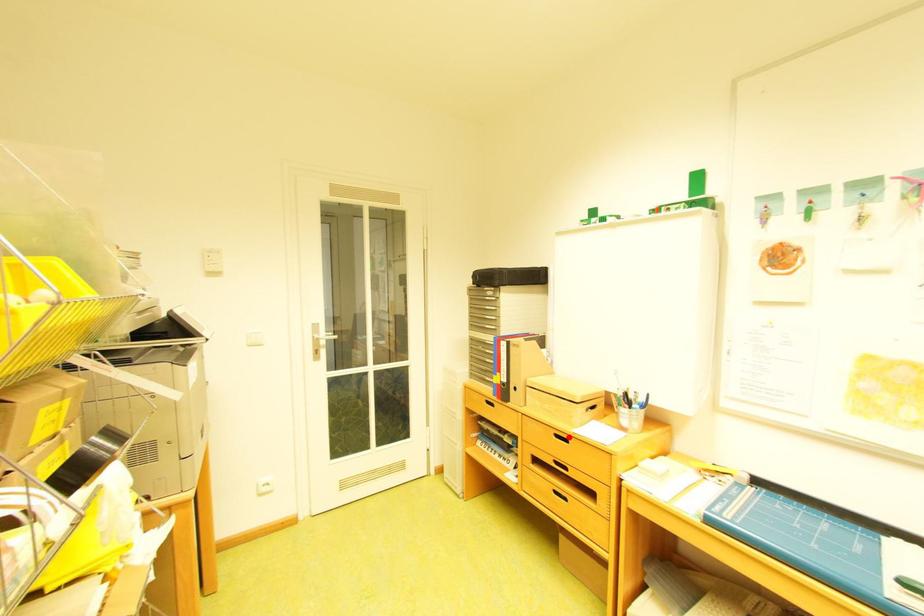
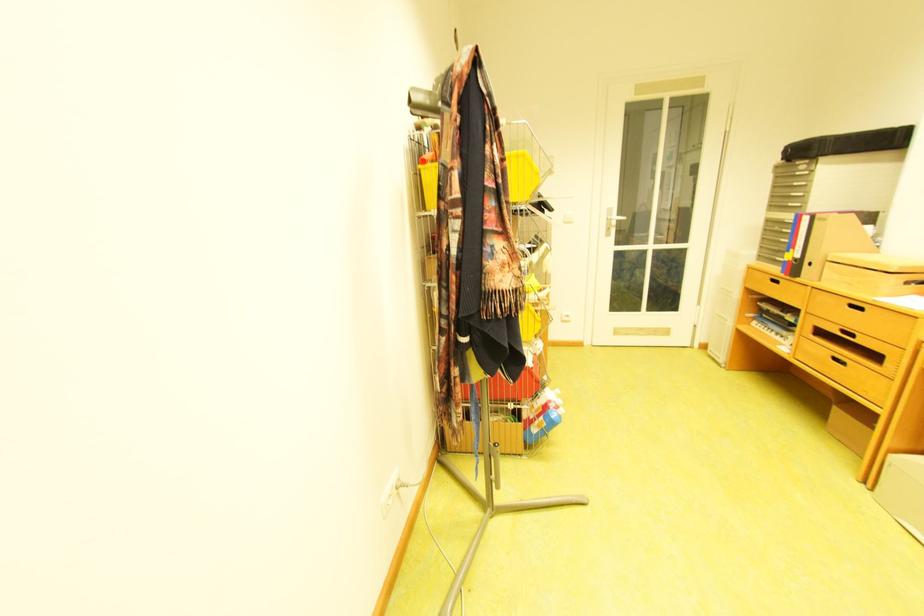
Locate, in the second image, the point that corresponds to the highlighted location in the first image.

(862, 307)